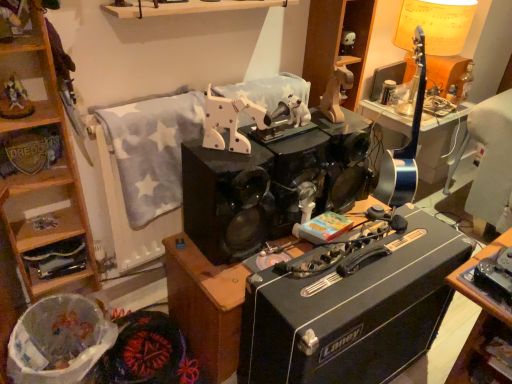
Question: From a real-world perspective, is matte yellow lampshade at upper right positioned over white plastic trash can at lower left based on gravity?

Choices:
 (A) no
 (B) yes

Answer: (B)

Question: From a real-world perspective, is matte yellow lampshade at upper right beneath white plastic trash can at lower left?

Choices:
 (A) yes
 (B) no

Answer: (B)

Question: From the image's perspective, is matte yellow lampshade at upper right over white plastic trash can at lower left?

Choices:
 (A) yes
 (B) no

Answer: (A)

Question: Is matte yellow lampshade at upper right smaller than white plastic trash can at lower left?

Choices:
 (A) no
 (B) yes

Answer: (A)

Question: Considering the relative sizes of matte yellow lampshade at upper right and white plastic trash can at lower left in the image provided, is matte yellow lampshade at upper right taller than white plastic trash can at lower left?

Choices:
 (A) no
 (B) yes

Answer: (B)

Question: Looking at their shapes, would you say wooden shelf at lower left, which is counted as the second shelf, starting from the left, is wider or thinner than wooden horse at upper center, marked as the 2th toy in a right-to-left arrangement?

Choices:
 (A) thin
 (B) wide

Answer: (A)

Question: Is wooden shelf at lower left, the second shelf when ordered from bottom to top, to the left or to the right of wooden horse at upper center, marked as the 2th toy in a right-to-left arrangement, in the image?

Choices:
 (A) right
 (B) left

Answer: (B)

Question: From a real-world perspective, relative to wooden horse at upper center, placed as the third toy when sorted from bottom to top, is wooden shelf at lower left, the second shelf when ordered from bottom to top, vertically above or below?

Choices:
 (A) above
 (B) below

Answer: (B)

Question: Relative to wooden horse at upper center, marked as the 2th toy in a right-to-left arrangement, is wooden shelf at lower left, arranged as the second shelf when viewed from the right, in front or behind?

Choices:
 (A) behind
 (B) front

Answer: (A)

Question: In terms of size, does wooden horse at upper center, which is the 3th toy from left to right, appear bigger or smaller than wooden cabinet at lower left, acting as the 2th cabinetry starting from the right?

Choices:
 (A) small
 (B) big

Answer: (A)

Question: Is wooden horse at upper center, placed as the third toy when sorted from bottom to top, inside the boundaries of wooden cabinet at lower left, placed as the 1th cabinetry when sorted from bottom to top, or outside?

Choices:
 (A) outside
 (B) inside

Answer: (A)

Question: Is point (343, 114) closer or farther from the camera than point (12, 251)?

Choices:
 (A) farther
 (B) closer

Answer: (A)

Question: From their relative heights in the image, would you say wooden horse at upper center, which is the 2th toy in top-to-bottom order, is taller or shorter than wooden cabinet at lower left, placed as the 1th cabinetry when sorted from bottom to top?

Choices:
 (A) tall
 (B) short

Answer: (B)

Question: Is wooden horse at upper left, which is the first toy from left to right, wider or thinner than black glossy stereo at center?

Choices:
 (A) thin
 (B) wide

Answer: (A)

Question: Is point (0, 114) closer or farther from the camera than point (239, 251)?

Choices:
 (A) closer
 (B) farther

Answer: (A)